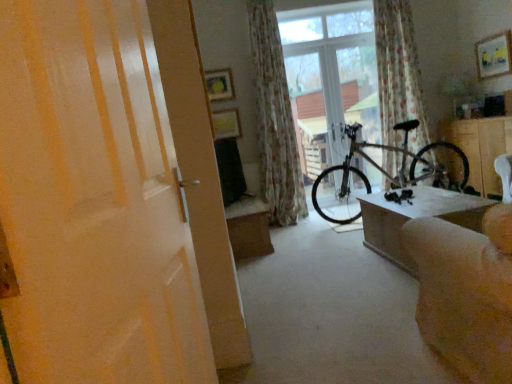
The width and height of the screenshot is (512, 384). Describe the element at coordinates (219, 84) in the screenshot. I see `matte wooden picture frame at upper center, which is counted as the second picture frame, starting from the bottom` at that location.

Find the location of a particular element. matte wooden picture frame at upper center, which is counted as the second picture frame, starting from the bottom is located at coordinates (219, 84).

The image size is (512, 384). Identify the location of silver metallic bicycle at center. (385, 173).

Describe the element at coordinates (93, 202) in the screenshot. The width and height of the screenshot is (512, 384). I see `matte white door at center` at that location.

What do you see at coordinates (416, 217) in the screenshot? The image size is (512, 384). I see `wooden coffee table at lower right, which ranks as the 2th table in left-to-right order` at bounding box center [416, 217].

In order to face floral fabric curtain at center, which appears as the second curtain when viewed from the right, should I rotate leftwards or rightwards?

Turn right approximately 2.093 degrees to face it.

Find the location of a particular element. The height and width of the screenshot is (384, 512). floral fabric curtain at center, which appears as the second curtain when viewed from the right is located at coordinates (x=275, y=120).

The image size is (512, 384). What are the coordinates of `matte wooden picture frame at upper center, which is counted as the second picture frame, starting from the bottom` in the screenshot? It's located at (219, 84).

Considering the relative sizes of wooden painted picture frame at upper right, which is the first picture frame in front-to-back order, and wooden table at center, placed as the second table when sorted from front to back, in the image provided, is wooden painted picture frame at upper right, which is the first picture frame in front-to-back order, wider than wooden table at center, placed as the second table when sorted from front to back,?

No, wooden painted picture frame at upper right, which is the first picture frame in front-to-back order, is not wider than wooden table at center, placed as the second table when sorted from front to back.

Locate an element on the screen. the 3rd picture frame above the wooden table at center, the second table positioned from the right (from the image's perspective) is located at coordinates (494, 55).

Can you tell me how much wooden painted picture frame at upper right, marked as the 3th picture frame in a left-to-right arrangement, and wooden table at center, placed as the second table when sorted from front to back, differ in facing direction?

wooden painted picture frame at upper right, marked as the 3th picture frame in a left-to-right arrangement, and wooden table at center, placed as the second table when sorted from front to back, are facing 180 degrees away from each other.

From a real-world perspective, which object rests below the other?

wooden table at center, the first table from the left.

Where is `the 1st curtain to the right when counting from the matte yellow picture frame at upper center, the first picture frame positioned from the back`? The image size is (512, 384). the 1st curtain to the right when counting from the matte yellow picture frame at upper center, the first picture frame positioned from the back is located at coordinates (275, 120).

Is floral fabric curtain at center, the 1th curtain from the left, completely or partially inside matte yellow picture frame at upper center, the third picture frame from the front?

That's incorrect, floral fabric curtain at center, the 1th curtain from the left, is not inside matte yellow picture frame at upper center, the third picture frame from the front.

Between point (220, 133) and point (297, 165), which one is positioned behind?

Point (297, 165)

Based on their positions, is matte yellow picture frame at upper center, which appears as the second picture frame when viewed from the right, located to the left or right of floral fabric curtain at center, which appears as the second curtain when viewed from the right?

Clearly, matte yellow picture frame at upper center, which appears as the second picture frame when viewed from the right, is on the left of floral fabric curtain at center, which appears as the second curtain when viewed from the right, in the image.

Can we say silver metallic bicycle at center lies outside wooden coffee table at lower right, which ranks as the 2th table in left-to-right order?

Indeed, silver metallic bicycle at center is completely outside wooden coffee table at lower right, which ranks as the 2th table in left-to-right order.

From their relative heights in the image, would you say silver metallic bicycle at center is taller or shorter than wooden coffee table at lower right, which ranks as the 2th table in left-to-right order?

In the image, silver metallic bicycle at center appears to be taller than wooden coffee table at lower right, which ranks as the 2th table in left-to-right order.

Is silver metallic bicycle at center not close to wooden coffee table at lower right, placed as the second table when sorted from back to front?

Yes, silver metallic bicycle at center and wooden coffee table at lower right, placed as the second table when sorted from back to front, are located far from each other.

Does point (369, 144) appear closer or farther from the camera than point (379, 234)?

Point (369, 144) is farther from the camera than point (379, 234).

From a real-world perspective, is silver metallic bicycle at center beneath floral fabric curtain at center, acting as the second curtain starting from the left?

Yes, from a real-world perspective, silver metallic bicycle at center is below floral fabric curtain at center, acting as the second curtain starting from the left.

Between silver metallic bicycle at center and floral fabric curtain at center, acting as the second curtain starting from the left, which one has larger width?

silver metallic bicycle at center.

Locate an element on the screen. bicycle located on the left of floral fabric curtain at center, which is the first curtain from right to left is located at coordinates (385, 173).

Is silver metallic bicycle at center bigger or smaller than floral fabric curtain at center, acting as the second curtain starting from the left?

silver metallic bicycle at center is bigger than floral fabric curtain at center, acting as the second curtain starting from the left.

This screenshot has width=512, height=384. Identify the location of table lying below the wooden coffee table at lower right, which ranks as the 2th table in left-to-right order (from the image's perspective). (249, 228).

From the image's perspective, is wooden coffee table at lower right, acting as the 1th table starting from the front, located beneath wooden table at center, the second table positioned from the right?

No, from the image's perspective, wooden coffee table at lower right, acting as the 1th table starting from the front, is not below wooden table at center, the second table positioned from the right.

Looking at this image, can we say wooden coffee table at lower right, acting as the 1th table starting from the front, lies outside wooden table at center, marked as the first table in a back-to-front arrangement?

That's correct, wooden coffee table at lower right, acting as the 1th table starting from the front, is outside of wooden table at center, marked as the first table in a back-to-front arrangement.

Is wooden coffee table at lower right, which ranks as the 2th table in left-to-right order, to the left of wooden table at center, the second table positioned from the right, from the viewer's perspective?

Incorrect, wooden coffee table at lower right, which ranks as the 2th table in left-to-right order, is not on the left side of wooden table at center, the second table positioned from the right.

The width and height of the screenshot is (512, 384). Find the location of `picture frame beneath the floral fabric curtain at center, which is the first curtain from right to left (from a real-world perspective)`. picture frame beneath the floral fabric curtain at center, which is the first curtain from right to left (from a real-world perspective) is located at coordinates (226, 123).

Is floral fabric curtain at center, which is the first curtain from right to left, next to matte yellow picture frame at upper center, the third picture frame from the front?

There is a gap between floral fabric curtain at center, which is the first curtain from right to left, and matte yellow picture frame at upper center, the third picture frame from the front.

From the image's perspective, who appears lower, floral fabric curtain at center, which is the first curtain from right to left, or matte yellow picture frame at upper center, which ranks as the first picture frame in bottom-to-top order?

matte yellow picture frame at upper center, which ranks as the first picture frame in bottom-to-top order, appears lower in the image.

Looking at their sizes, would you say floral fabric curtain at center, acting as the second curtain starting from the left, is wider or thinner than matte yellow picture frame at upper center, acting as the third picture frame starting from the top?

Clearly, floral fabric curtain at center, acting as the second curtain starting from the left, has more width compared to matte yellow picture frame at upper center, acting as the third picture frame starting from the top.

Is silver metallic bicycle at center aimed at floral fabric curtain at center, the 1th curtain from the left?

No, silver metallic bicycle at center is not turned towards floral fabric curtain at center, the 1th curtain from the left.

Is silver metallic bicycle at center in front of or behind floral fabric curtain at center, which appears as the second curtain when viewed from the right, in the image?

silver metallic bicycle at center is in front of floral fabric curtain at center, which appears as the second curtain when viewed from the right.

Considering the positions of objects silver metallic bicycle at center and floral fabric curtain at center, the 1th curtain from the left, in the image provided, who is more to the left, silver metallic bicycle at center or floral fabric curtain at center, the 1th curtain from the left,?

From the viewer's perspective, floral fabric curtain at center, the 1th curtain from the left, appears more on the left side.

From a real-world perspective, starting from the silver metallic bicycle at center, which curtain is the 2nd one vertically above it? Please provide its 2D coordinates.

[(275, 120)]

From the wooden table at center, the first table from the left, count 1st picture frames backward and point to it. Please provide its 2D coordinates.

[(494, 55)]

The image size is (512, 384). In order to click on the 2nd curtain above the matte yellow picture frame at upper center, which appears as the 2th picture frame when viewed from the left (from a real-world perspective) in this screenshot , I will do `click(275, 120)`.

From the image, which object appears to be nearer to silver metallic bicycle at center, wooden table at center, the second table positioned from the right, or floral fabric curtain at center, acting as the second curtain starting from the left?

floral fabric curtain at center, acting as the second curtain starting from the left, is positioned closer to the anchor silver metallic bicycle at center.

When comparing their distances from matte wooden picture frame at upper center, the first picture frame from the left, does wooden cabinet at right or transparent glass window at center seem closer?

transparent glass window at center is positioned closer to the anchor matte wooden picture frame at upper center, the first picture frame from the left.

Looking at the image, which one is located closer to floral fabric curtain at center, the 1th curtain from the left, wooden table at center, the first table from the left, or transparent glass window at center?

transparent glass window at center.

Looking at the image, which one is located closer to matte white door at center, wooden table at center, marked as the first table in a back-to-front arrangement, or matte yellow picture frame at upper center, acting as the third picture frame starting from the top?

The object closer to matte white door at center is wooden table at center, marked as the first table in a back-to-front arrangement.

Looking at the image, which one is located closer to floral fabric curtain at center, which appears as the second curtain when viewed from the right, matte yellow picture frame at upper center, which ranks as the first picture frame in bottom-to-top order, or silver metallic bicycle at center?

matte yellow picture frame at upper center, which ranks as the first picture frame in bottom-to-top order, is closer to floral fabric curtain at center, which appears as the second curtain when viewed from the right.

Based on their spatial positions, is matte wooden picture frame at upper center, arranged as the second picture frame when viewed from the top, or floral fabric curtain at center, which is the first curtain from right to left, closer to wooden cabinet at right?

The object closer to wooden cabinet at right is floral fabric curtain at center, which is the first curtain from right to left.

Based on their spatial positions, is transparent glass window at center or matte white door at center further from wooden coffee table at lower right, which ranks as the 2th table in left-to-right order?

The object further to wooden coffee table at lower right, which ranks as the 2th table in left-to-right order, is transparent glass window at center.

Estimate the real-world distances between objects in this image. Which object is further from wooden table at center, placed as the second table when sorted from front to back, silver metallic bicycle at center or matte white door at center?

matte white door at center is positioned further to the anchor wooden table at center, placed as the second table when sorted from front to back.

I want to click on bicycle between matte wooden picture frame at upper center, arranged as the 3th picture frame when viewed from the right, and floral fabric curtain at center, acting as the second curtain starting from the left, in the horizontal direction, so click(x=385, y=173).

At what (x,y) coordinates should I click in order to perform the action: click on couch positioned between matte white door at center and wooden cabinet at right from near to far. Please return your answer as a coordinate pair (x, y). Looking at the image, I should click on (466, 292).

Find the location of a particular element. couch between matte white door at center and matte wooden picture frame at upper center, the first picture frame from the left, in the front-back direction is located at coordinates (466, 292).

Where is `cabinetry between matte white door at center and matte wooden picture frame at upper center, the first picture frame from the left, in the front-back direction`? Image resolution: width=512 pixels, height=384 pixels. cabinetry between matte white door at center and matte wooden picture frame at upper center, the first picture frame from the left, in the front-back direction is located at coordinates (481, 148).